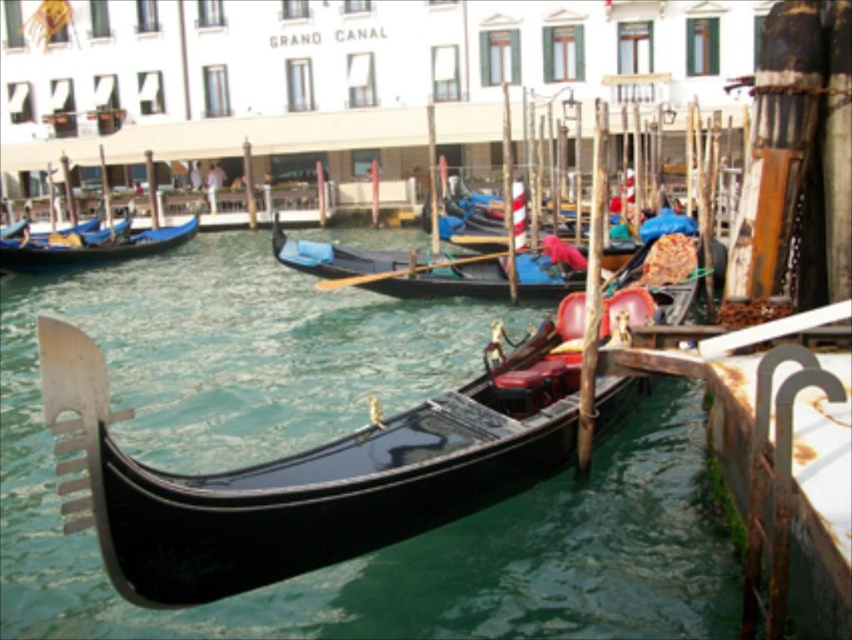
Is glossy black gondola at center above blue polished wood gondola at left?

No, glossy black gondola at center is not above blue polished wood gondola at left.

Is glossy black gondola at center below blue polished wood gondola at left?

Indeed, glossy black gondola at center is positioned under blue polished wood gondola at left.

Describe the element at coordinates (308, 472) in the screenshot. This screenshot has height=640, width=852. I see `glossy black gondola at center` at that location.

Where is `glossy black gondola at center`? The width and height of the screenshot is (852, 640). glossy black gondola at center is located at coordinates (308, 472).

Does black polished gondola at center have a smaller size compared to blue polished wood gondola at left?

No.

Between point (427, 296) and point (33, 259), which one is positioned in front?

Point (427, 296) is in front.

The height and width of the screenshot is (640, 852). I want to click on black polished gondola at center, so click(x=395, y=268).

Who is taller, glossy black gondola at center or black polished gondola at center?

glossy black gondola at center

Is glossy black gondola at center in front of black polished gondola at center?

Yes.

Is point (91, 483) positioned after point (396, 280)?

No, it is in front of (396, 280).

This screenshot has width=852, height=640. I want to click on glossy black gondola at center, so click(x=308, y=472).